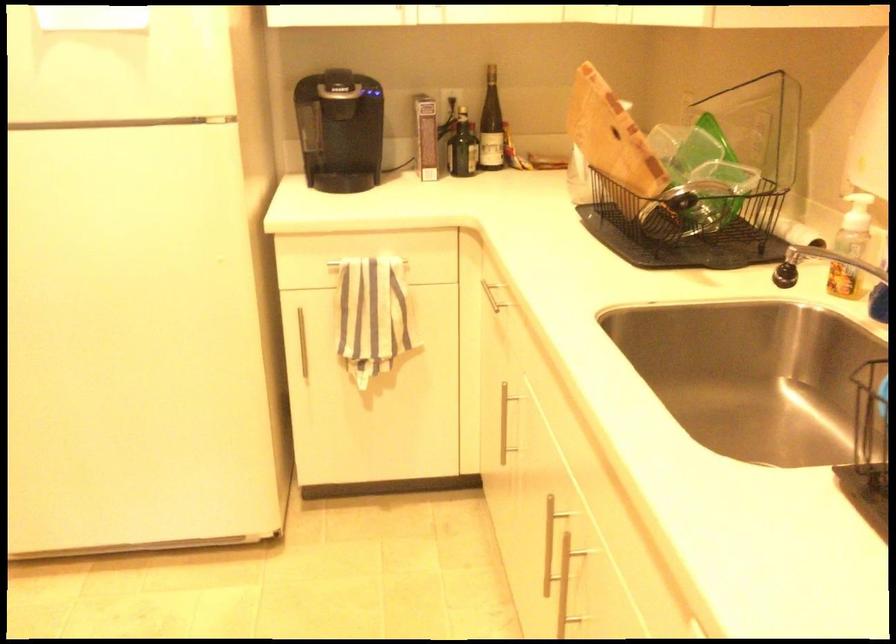
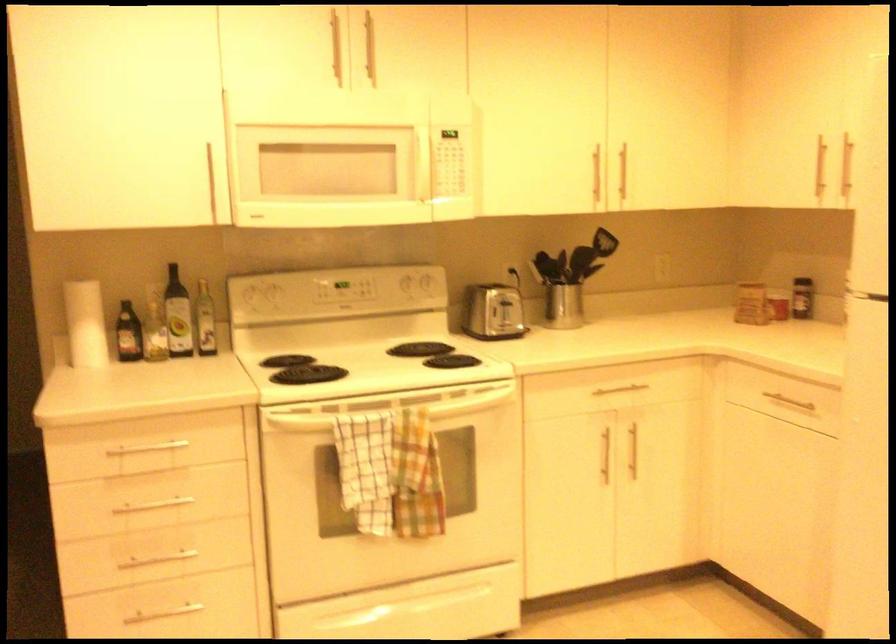
Question: The camera is either moving clockwise (left) or counter-clockwise (right) around the object. The first image is from the beginning of the video and the second image is from the end. Is the camera moving left or right when shooting the video?

Choices:
 (A) Left
 (B) Right

Answer: (B)